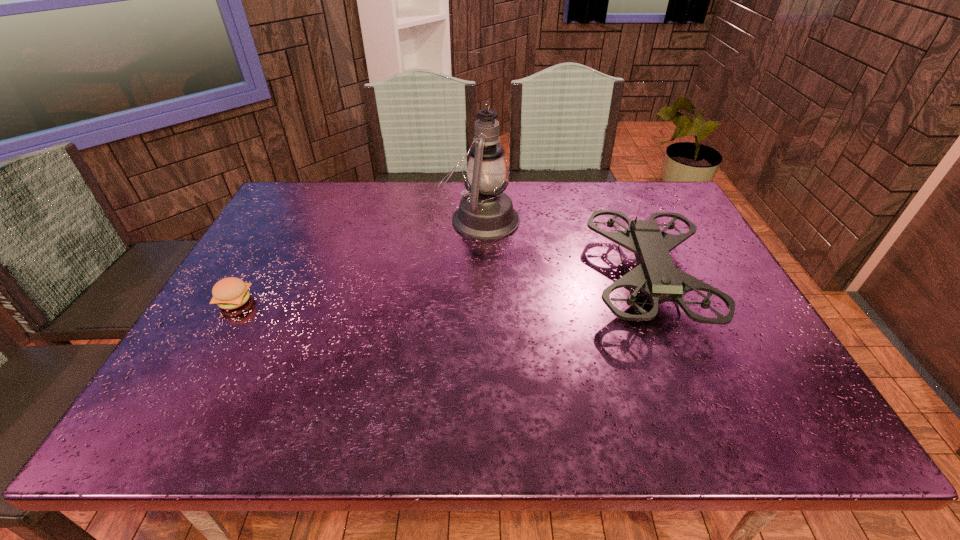
This screenshot has width=960, height=540. I want to click on free space between the hamburger and the oil lamp, so click(357, 260).

The height and width of the screenshot is (540, 960). Find the location of `free area in between the tallest object and the shortest object`. free area in between the tallest object and the shortest object is located at coordinates (357, 260).

You are a GUI agent. You are given a task and a screenshot of the screen. Output one action in this format:
    pyautogui.click(x=<x>, y=<y>)
    Task: Click on the vacant area that lies between the tallest object and the second tallest object
    The height and width of the screenshot is (540, 960).
    Given the screenshot: What is the action you would take?
    pyautogui.click(x=564, y=249)

Locate an element on the screen. This screenshot has width=960, height=540. vacant space in between the second shortest object and the second object from left to right is located at coordinates (564, 249).

Locate an element on the screen. free area in between the tallest object and the rightmost object is located at coordinates (564, 249).

This screenshot has height=540, width=960. In order to click on empty location between the leftmost object and the oil lamp in this screenshot , I will do (x=357, y=260).

Find the location of a particular element. free space between the leftmost object and the second object from right to left is located at coordinates pyautogui.click(x=357, y=260).

The height and width of the screenshot is (540, 960). Identify the location of free space that is in between the shortest object and the drone. (441, 290).

The width and height of the screenshot is (960, 540). I want to click on object that is the second closest to the drone, so click(229, 293).

Find the location of `object that stands as the closest to the tallest object`. object that stands as the closest to the tallest object is located at coordinates (656, 276).